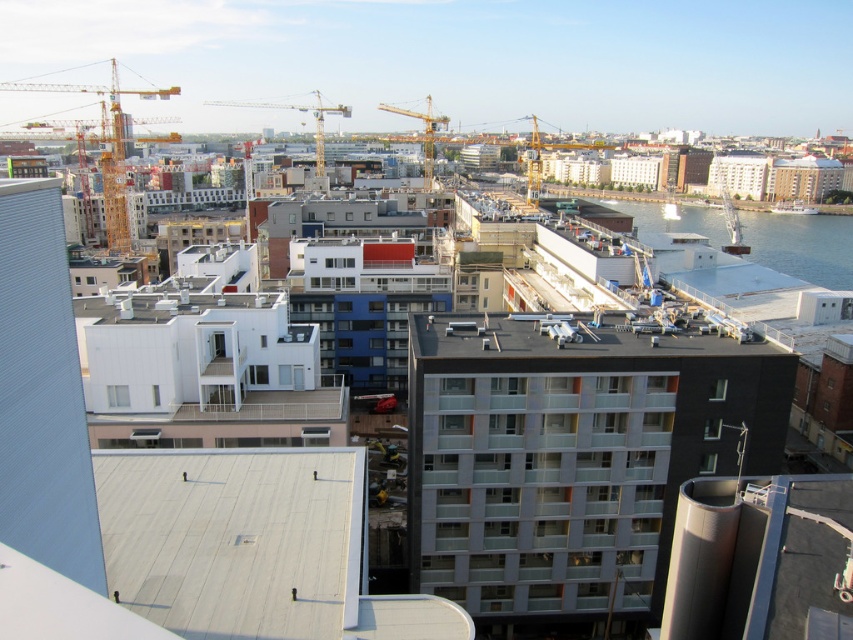
Question: Does clear blue water at lower right have a greater width compared to yellow metallic crane at upper left?

Choices:
 (A) yes
 (B) no

Answer: (B)

Question: Can you confirm if yellow metallic crane at upper left is positioned below yellow metallic crane at center?

Choices:
 (A) yes
 (B) no

Answer: (B)

Question: Estimate the real-world distances between objects in this image. Which object is closer to the yellow metallic crane at upper left?

Choices:
 (A) yellow metallic crane at center
 (B) matte glass building at center

Answer: (A)

Question: Which of these objects is positioned closest to the metallic yellow crane at center?

Choices:
 (A) yellow metallic crane at upper left
 (B) matte glass building at center

Answer: (A)

Question: Which point is closer to the camera?

Choices:
 (A) metallic yellow crane at center
 (B) clear blue water at lower right
 (C) matte glass building at center
 (D) yellow metallic crane at center

Answer: (C)

Question: Observing the image, what is the correct spatial positioning of matte glass building at center in reference to yellow metallic crane at center?

Choices:
 (A) left
 (B) right

Answer: (B)